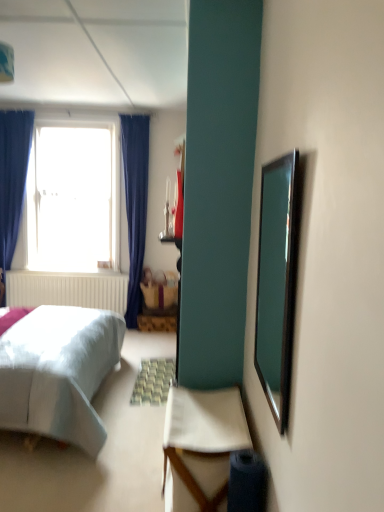
The image size is (384, 512). What do you see at coordinates (276, 282) in the screenshot?
I see `clear glass mirror at right` at bounding box center [276, 282].

What is the approximate width of white fabric chair at lower center?

white fabric chair at lower center is 16.04 inches in width.

Describe the element at coordinates (73, 199) in the screenshot. Image resolution: width=384 pixels, height=512 pixels. I see `transparent glass window at upper left` at that location.

What do you see at coordinates (159, 296) in the screenshot?
I see `wooden picnic basket at center` at bounding box center [159, 296].

The width and height of the screenshot is (384, 512). In order to click on clear glass mirror at right in this screenshot , I will do `click(276, 282)`.

Considering the relative positions of white fabric chair at lower center and transparent glass window at upper left in the image provided, is white fabric chair at lower center to the left of transparent glass window at upper left from the viewer's perspective?

Incorrect, white fabric chair at lower center is not on the left side of transparent glass window at upper left.

From a real-world perspective, is white fabric chair at lower center located beneath transparent glass window at upper left?

Yes, from a real-world perspective, white fabric chair at lower center is under transparent glass window at upper left.

Which object is further away from the camera, white fabric chair at lower center or transparent glass window at upper left?

transparent glass window at upper left is further away from the camera.

Is white fabric chair at lower center situated inside transparent glass window at upper left or outside?

white fabric chair at lower center is located beyond the bounds of transparent glass window at upper left.

Is wooden picnic basket at center smaller than transparent glass window at upper left?

Correct, wooden picnic basket at center occupies less space than transparent glass window at upper left.

Is wooden picnic basket at center turned away from transparent glass window at upper left?

wooden picnic basket at center does not have its back to transparent glass window at upper left.

Is wooden picnic basket at center to the right of transparent glass window at upper left from the viewer's perspective?

Yes.

How distant is wooden picnic basket at center from transparent glass window at upper left?

wooden picnic basket at center and transparent glass window at upper left are 1.29 meters apart.

Identify the location of picnic basket located above the white fabric chair at lower center (from the image's perspective). pyautogui.click(x=159, y=296).

Is wooden picnic basket at center shorter than white fabric chair at lower center?

Yes, wooden picnic basket at center is shorter than white fabric chair at lower center.

Is the depth of wooden picnic basket at center less than that of white fabric chair at lower center?

No, the depth of wooden picnic basket at center is greater than that of white fabric chair at lower center.

From a real-world perspective, does wooden picnic basket at center stand above white fabric chair at lower center?

Yes.

Which is correct: clear glass mirror at right is inside transparent glass window at upper left, or outside of it?

clear glass mirror at right is spatially situated outside transparent glass window at upper left.

Is clear glass mirror at right next to transparent glass window at upper left and touching it?

No, clear glass mirror at right is not beside transparent glass window at upper left.

In the scene shown: From the image's perspective, is clear glass mirror at right located above or below transparent glass window at upper left?

clear glass mirror at right is situated lower than transparent glass window at upper left in the image.

In the scene shown: Considering the relative positions of transparent glass window at upper left and clear glass mirror at right in the image provided, is transparent glass window at upper left to the left or to the right of clear glass mirror at right?

transparent glass window at upper left is positioned on clear glass mirror at right's left side.

Which of these two, transparent glass window at upper left or clear glass mirror at right, stands taller?

Standing taller between the two is transparent glass window at upper left.

In the scene shown: From the image's perspective, who appears lower, transparent glass window at upper left or clear glass mirror at right?

From the image's view, clear glass mirror at right is below.

Relative to clear glass mirror at right, is transparent glass window at upper left in front or behind?

Visually, transparent glass window at upper left is located behind clear glass mirror at right.

Is wooden picnic basket at center inside transparent glass window at upper left?

Definitely not — wooden picnic basket at center is not inside transparent glass window at upper left.

Does transparent glass window at upper left touch wooden picnic basket at center?

No, transparent glass window at upper left is not with wooden picnic basket at center.

From a real-world perspective, which is physically below, transparent glass window at upper left or wooden picnic basket at center?

wooden picnic basket at center.

Is transparent glass window at upper left in front of or behind wooden picnic basket at center in the image?

In the image, transparent glass window at upper left appears in front of wooden picnic basket at center.

Is clear glass mirror at right looking in the opposite direction of white fabric chair at lower center?

No, clear glass mirror at right's orientation is not away from white fabric chair at lower center.

Considering the relative sizes of clear glass mirror at right and white fabric chair at lower center in the image provided, is clear glass mirror at right thinner than white fabric chair at lower center?

Correct, the width of clear glass mirror at right is less than that of white fabric chair at lower center.

Between clear glass mirror at right and white fabric chair at lower center, which one has larger size?

white fabric chair at lower center.

Can we say clear glass mirror at right lies outside white fabric chair at lower center?

That's correct, clear glass mirror at right is outside of white fabric chair at lower center.

Image resolution: width=384 pixels, height=512 pixels. Identify the location of desk beneath the transparent glass window at upper left (from a real-world perspective). (201, 445).

This screenshot has width=384, height=512. I want to click on window in front of the wooden picnic basket at center, so click(73, 199).

Looking at the image, which one is located closer to wooden picnic basket at center, clear glass mirror at right or transparent glass window at upper left?

transparent glass window at upper left is closer to wooden picnic basket at center.

Looking at the image, which one is located closer to white fabric chair at lower center, transparent glass window at upper left or clear glass mirror at right?

Based on the image, clear glass mirror at right appears to be nearer to white fabric chair at lower center.

Based on their spatial positions, is clear glass mirror at right or white fabric chair at lower center closer to wooden picnic basket at center?

white fabric chair at lower center is positioned closer to the anchor wooden picnic basket at center.

Considering their positions, is wooden picnic basket at center positioned closer to clear glass mirror at right than transparent glass window at upper left?

Among the two, wooden picnic basket at center is located nearer to clear glass mirror at right.

Considering their positions, is white fabric chair at lower center positioned closer to clear glass mirror at right than wooden picnic basket at center?

Based on the image, white fabric chair at lower center appears to be nearer to clear glass mirror at right.

From the image, which object appears to be farther from white fabric chair at lower center, clear glass mirror at right or transparent glass window at upper left?

transparent glass window at upper left.

Estimate the real-world distances between objects in this image. Which object is closer to white fabric chair at lower center, clear glass mirror at right or wooden picnic basket at center?

clear glass mirror at right is closer to white fabric chair at lower center.

Based on their spatial positions, is transparent glass window at upper left or wooden picnic basket at center further from clear glass mirror at right?

transparent glass window at upper left is further to clear glass mirror at right.

The height and width of the screenshot is (512, 384). I want to click on window positioned between white fabric chair at lower center and wooden picnic basket at center from near to far, so click(x=73, y=199).

Identify the location of window between clear glass mirror at right and wooden picnic basket at center from front to back. This screenshot has width=384, height=512. (73, 199).

I want to click on desk positioned between clear glass mirror at right and wooden picnic basket at center from near to far, so click(x=201, y=445).

This screenshot has width=384, height=512. What are the coordinates of `desk positioned between clear glass mirror at right and transparent glass window at upper left from near to far` in the screenshot? It's located at click(201, 445).